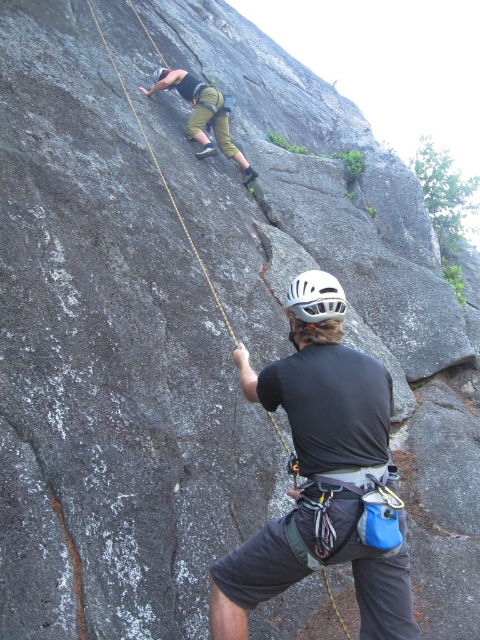
Is black fabric helmet at upper center taller than green fabric pants at upper center?

In fact, black fabric helmet at upper center may be shorter than green fabric pants at upper center.

Which is below, black fabric helmet at upper center or green fabric pants at upper center?

black fabric helmet at upper center

Is point (298, 456) less distant than point (199, 134)?

That is True.

Where is `black fabric helmet at upper center`? This screenshot has height=640, width=480. black fabric helmet at upper center is located at coordinates (324, 488).

Does point (225, 113) come farther from viewer compared to point (310, 291)?

That is True.

Who is taller, green fabric pants at upper center or white matte helmet at center?

green fabric pants at upper center

Who is more forward, (160, 81) or (331, 280)?

Point (331, 280) is in front.

Locate an element on the screen. The width and height of the screenshot is (480, 640). green fabric pants at upper center is located at coordinates [204, 115].

Is black fabric helmet at upper center further to camera compared to white matte helmet at center?

No, black fabric helmet at upper center is in front of white matte helmet at center.

Does point (316, 333) come farther from viewer compared to point (304, 275)?

No, (316, 333) is closer to viewer.

Does point (322, 483) lie in front of point (323, 288)?

Yes, it is.

In order to click on black fabric helmet at upper center in this screenshot , I will do `click(324, 488)`.